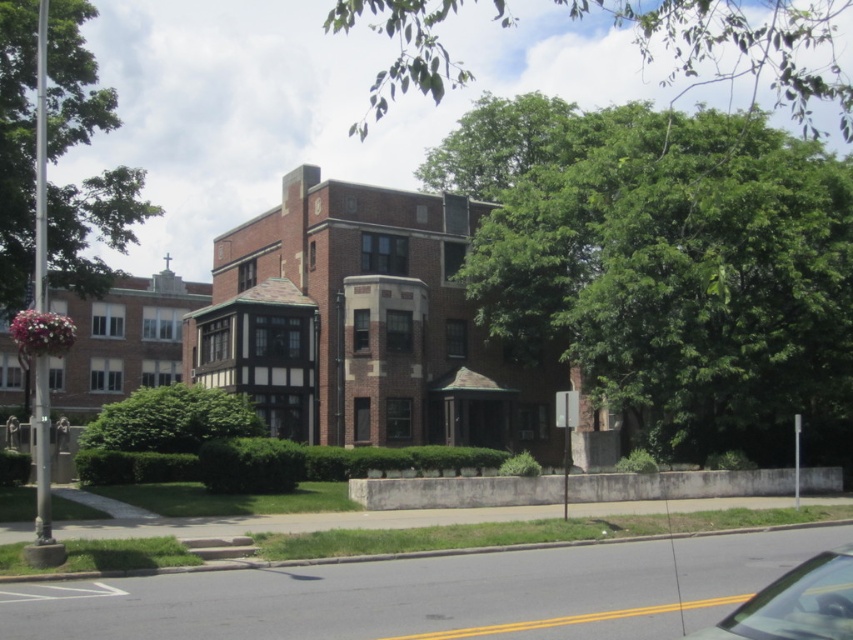
Who is more distant from viewer, [778,93] or [848,544]?

The point [778,93] is more distant.

Is green leafy tree at upper center to the right of metallic silver car at lower right from the viewer's perspective?

Yes, green leafy tree at upper center is to the right of metallic silver car at lower right.

Which is in front, point (360, 20) or point (842, 548)?

Positioned in front is point (842, 548).

Locate an element on the screen. This screenshot has width=853, height=640. green leafy tree at upper center is located at coordinates (741, 45).

Describe the element at coordinates (666, 266) in the screenshot. I see `green leafy tree at center` at that location.

Is green leafy tree at center above green leafy bush at center?

Correct, green leafy tree at center is located above green leafy bush at center.

Who is more forward, (540, 202) or (109, 429)?

Point (109, 429)

The width and height of the screenshot is (853, 640). In order to click on green leafy tree at center in this screenshot , I will do `click(666, 266)`.

Based on the photo, who is more distant from viewer, (x=103, y=225) or (x=764, y=609)?

Positioned behind is point (x=103, y=225).

Does green leafy tree at upper left have a greater width compared to metallic silver car at lower right?

Indeed, green leafy tree at upper left has a greater width compared to metallic silver car at lower right.

Where is `green leafy tree at upper left`? green leafy tree at upper left is located at coordinates (16, 150).

At what (x,y) coordinates should I click in order to perform the action: click on green leafy tree at upper left. Please return your answer as a coordinate pair (x, y). Image resolution: width=853 pixels, height=640 pixels. Looking at the image, I should click on 16,150.